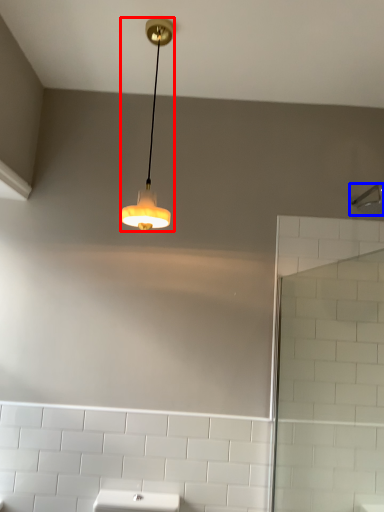
Question: Which of the following is the closest to the observer, lamp (highlighted by a red box) or shower (highlighted by a blue box)?

Choices:
 (A) lamp
 (B) shower

Answer: (A)